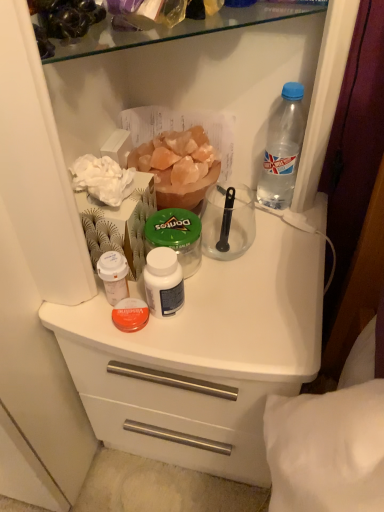
Locate an element on the screen. Image resolution: width=384 pixels, height=512 pixels. free spot to the right of green plastic jar at center is located at coordinates (261, 275).